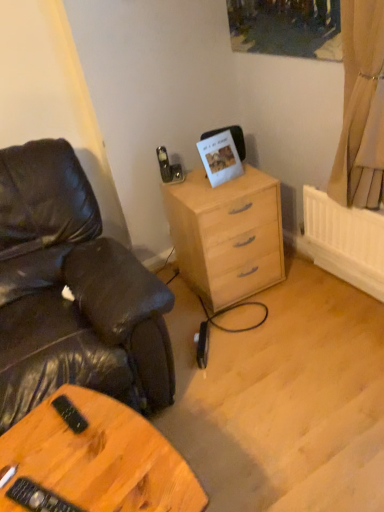
Identify the location of free space above wooden table at lower left (from a real-world perspective). (86, 459).